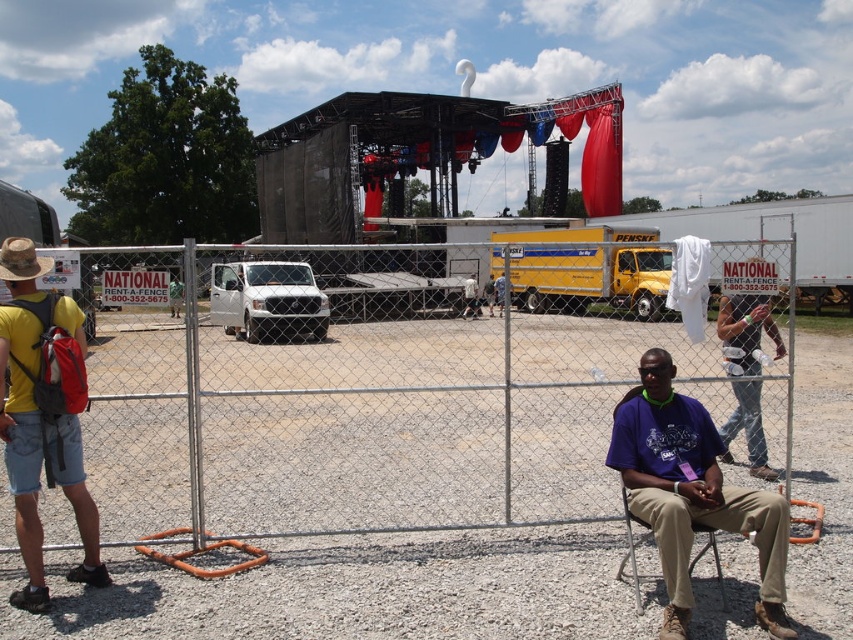
You are at the event and want to locate the purple cotton shirt at center. According to the coordinates given, where should you look?

The purple cotton shirt at center is located at point 0.772 on the x axis and 0.811 on the y axis.

You are standing in the outdoor event area and want to know which of the two points, point (x=764, y=556) or point (x=778, y=337), is closer to you. Based on the image description, which point is nearer?

Point (x=764, y=556) is closer to the camera than point (x=778, y=337).